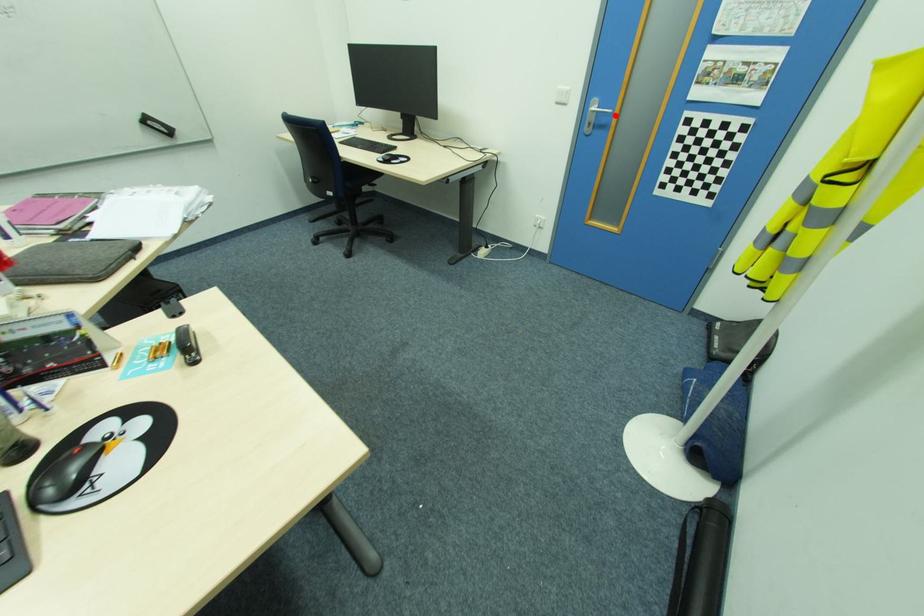
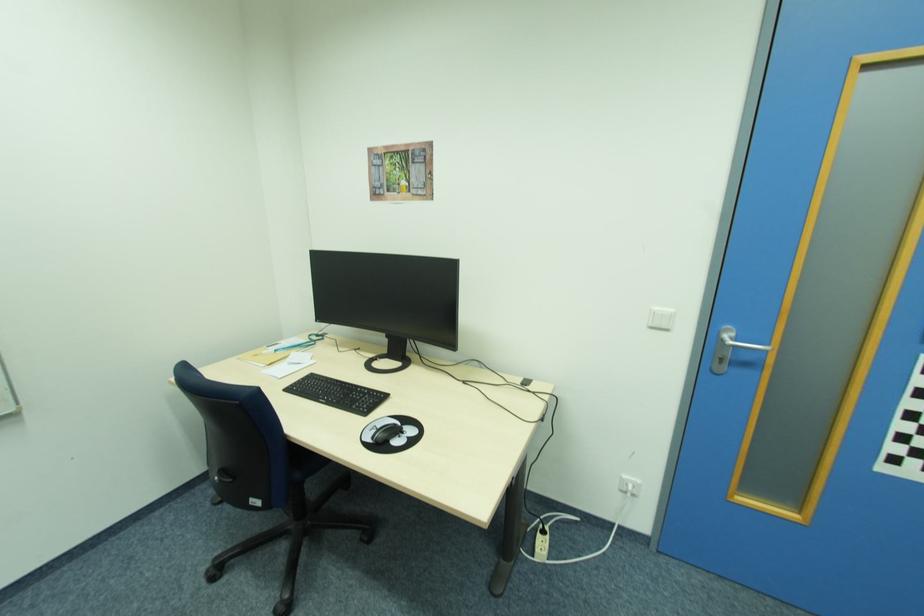
Locate, in the second image, the point that corresponds to the highlighted location in the first image.

(768, 350)